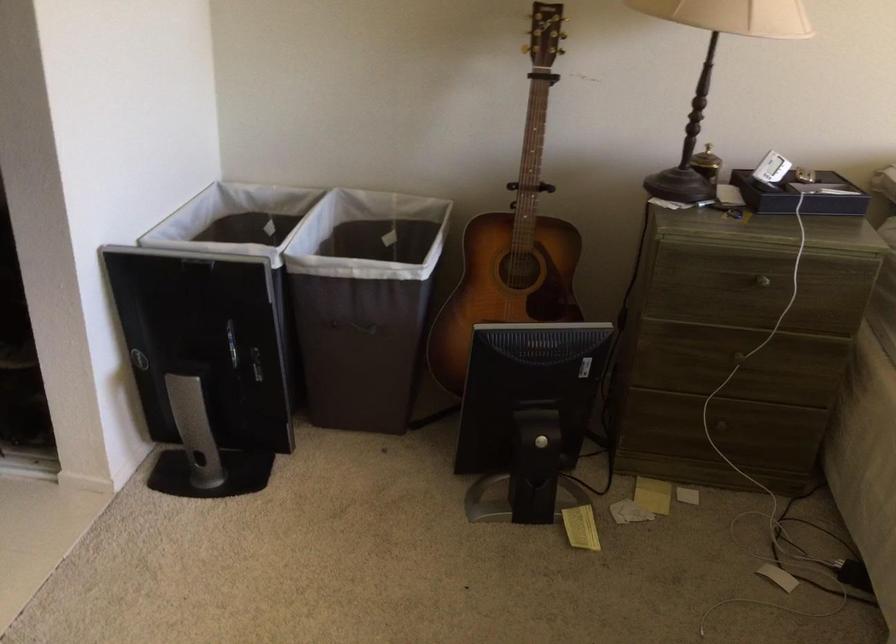
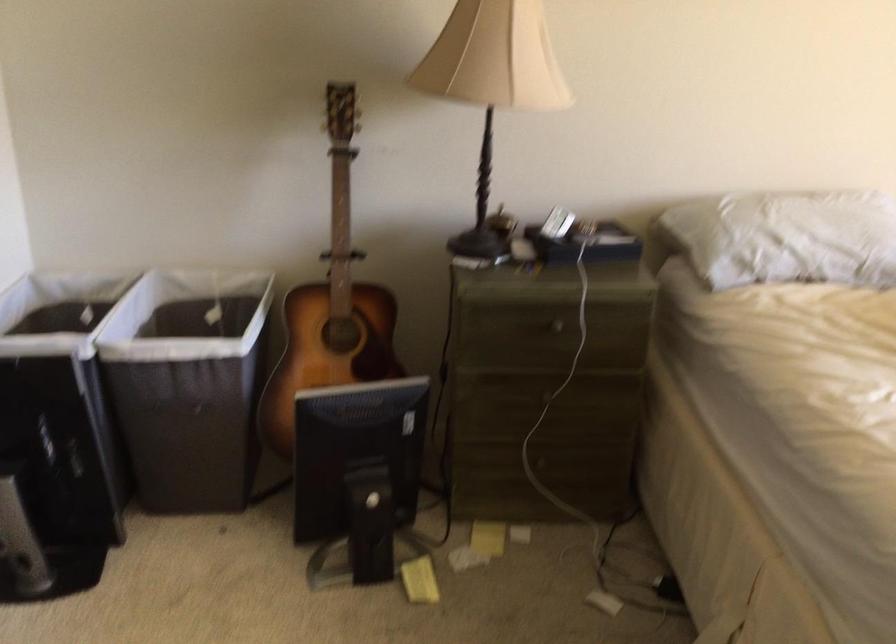
Find the pixel in the second image that matches [511,234] in the first image.

(331, 303)